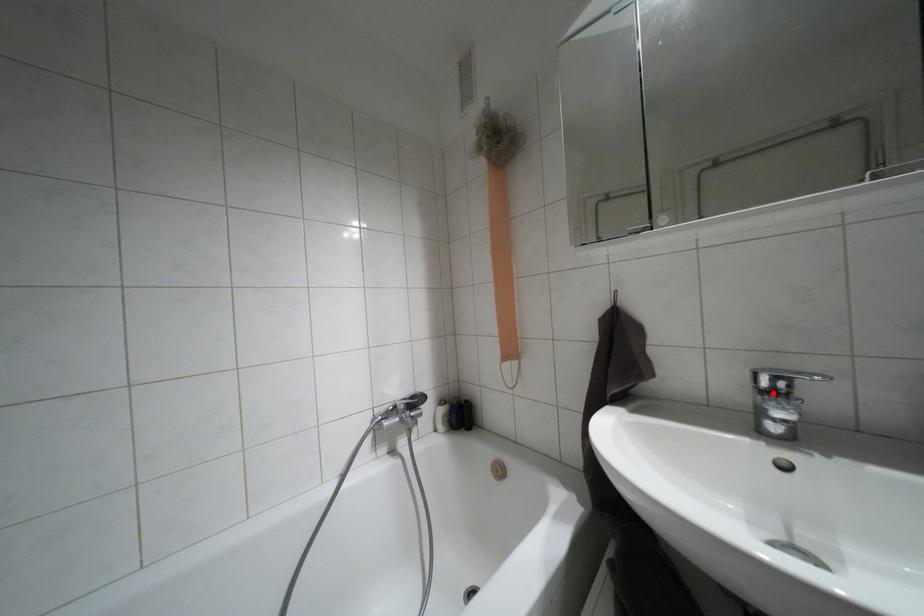
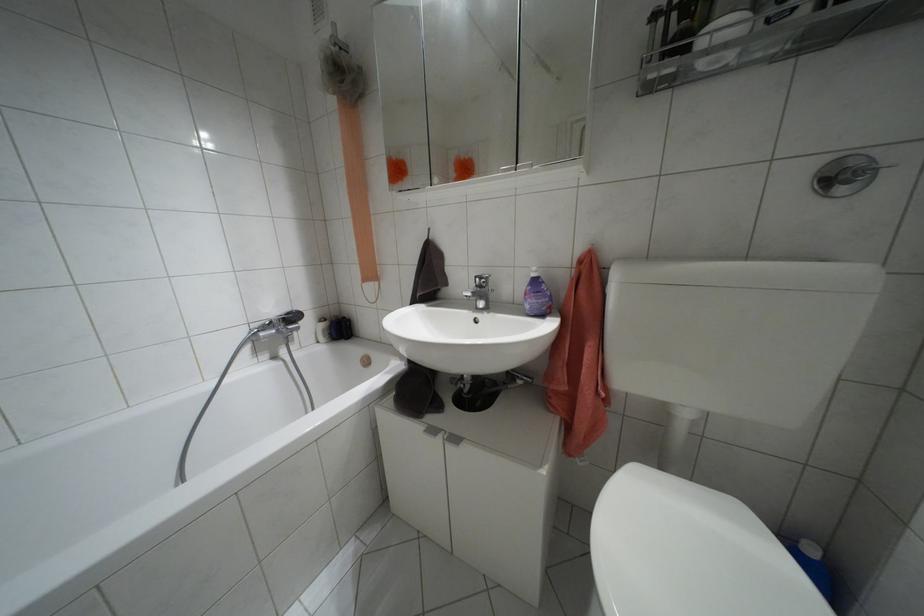
Locate, in the second image, the point that corresponds to the highlighted location in the first image.

(479, 286)